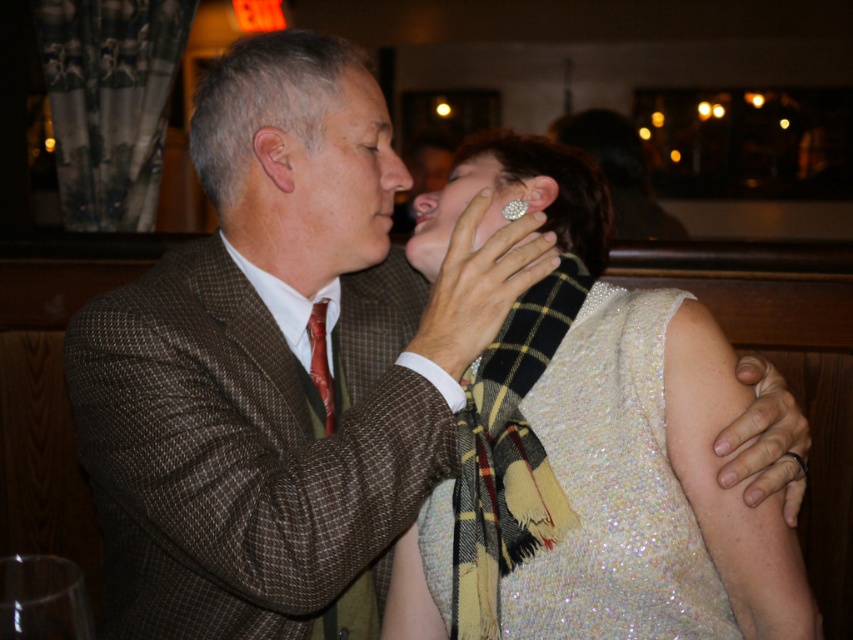
Question: Which object appears closest to the camera in this image?

Choices:
 (A) black metal ring at upper right
 (B) shiny silk tie at center
 (C) diamond shiny ring at ear
 (D) sparkly white dress at center

Answer: (D)

Question: Does shiny silk tie at center have a greater width compared to diamond shiny ring at ear?

Choices:
 (A) yes
 (B) no

Answer: (A)

Question: Which object appears farthest from the camera in this image?

Choices:
 (A) black metal ring at upper right
 (B) sparkly white dress at center
 (C) shiny silk tie at center
 (D) diamond shiny ring at ear

Answer: (C)

Question: Is diamond shiny ring at ear further to the viewer compared to black metal ring at upper right?

Choices:
 (A) no
 (B) yes

Answer: (B)

Question: Which point is farther to the camera?

Choices:
 (A) diamond shiny ring at ear
 (B) sparkly white dress at center

Answer: (A)

Question: Does sparkly white dress at center come behind shiny silk tie at center?

Choices:
 (A) no
 (B) yes

Answer: (A)